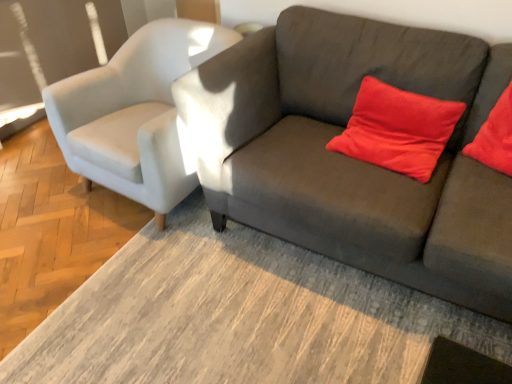
The image size is (512, 384). I want to click on satin white armchair at left, so [x=135, y=114].

You are a GUI agent. You are given a task and a screenshot of the screen. Output one action in this format:
    pyautogui.click(x=<x>, y=<y>)
    Task: Click on the dark gray fabric couch at center
    
    Given the screenshot: What is the action you would take?
    pyautogui.click(x=352, y=158)

Is satin red pillow at upper right not near dark gray fabric couch at center?

No.

From the image's perspective, is satin red pillow at upper right beneath dark gray fabric couch at center?

Incorrect, from the image's perspective, satin red pillow at upper right is higher than dark gray fabric couch at center.

The height and width of the screenshot is (384, 512). I want to click on studio couch below the satin red pillow at upper right (from the image's perspective), so click(x=352, y=158).

Does satin red pillow at upper right have a lesser width compared to dark gray fabric couch at center?

Yes, satin red pillow at upper right is thinner than dark gray fabric couch at center.

Considering the sizes of objects satin white armchair at left and dark gray fabric couch at center in the image provided, who is wider, satin white armchair at left or dark gray fabric couch at center?

With larger width is dark gray fabric couch at center.

Can you confirm if satin white armchair at left is positioned to the right of dark gray fabric couch at center?

No, satin white armchair at left is not to the right of dark gray fabric couch at center.

Looking at the image, does satin white armchair at left seem bigger or smaller compared to dark gray fabric couch at center?

Clearly, satin white armchair at left is smaller in size than dark gray fabric couch at center.

From the image's perspective, is satin white armchair at left on top of dark gray fabric couch at center?

Yes, from the image's perspective, satin white armchair at left is on top of dark gray fabric couch at center.

From a real-world perspective, is satin red pillow at upper right positioned over satin white armchair at left based on gravity?

Yes.

Is satin red pillow at upper right aimed at satin white armchair at left?

No.

Looking at this image, from the image's perspective, is satin red pillow at upper right on satin white armchair at left?

No.

From the image's perspective, is dark gray fabric couch at center above satin white armchair at left?

No, from the image's perspective, dark gray fabric couch at center is not above satin white armchair at left.

From their relative heights in the image, would you say dark gray fabric couch at center is taller or shorter than satin white armchair at left?

dark gray fabric couch at center is taller than satin white armchair at left.

Is point (499, 75) farther from camera compared to point (117, 75)?

No, (499, 75) is closer to viewer.

Does dark gray fabric couch at center contain satin white armchair at left?

No.

How many degrees apart are the facing directions of dark gray fabric couch at center and satin red pillow at upper right?

The facing directions of dark gray fabric couch at center and satin red pillow at upper right are 5.33 degrees apart.

In terms of width, does dark gray fabric couch at center look wider or thinner when compared to satin red pillow at upper right?

In the image, dark gray fabric couch at center appears to be wider than satin red pillow at upper right.

Identify the location of pillow behind the dark gray fabric couch at center. This screenshot has height=384, width=512. (398, 129).

Could you tell me if dark gray fabric couch at center is facing satin red pillow at upper right?

Yes, dark gray fabric couch at center is turned towards satin red pillow at upper right.

Is satin white armchair at left positioned far away from satin red pillow at upper right?

No, satin white armchair at left is not far from satin red pillow at upper right.

Locate an element on the screen. pillow below the satin white armchair at left (from the image's perspective) is located at coordinates (398, 129).

Does satin white armchair at left turn towards satin red pillow at upper right?

No.

Is satin white armchair at left not inside satin red pillow at upper right?

Yes.

Identify the location of studio couch below the satin red pillow at upper right (from the image's perspective). (x=352, y=158).

The image size is (512, 384). In the image, there is a dark gray fabric couch at center. Identify the location of chair above it (from the image's perspective). (135, 114).

When comparing their distances from satin white armchair at left, does dark gray fabric couch at center or satin red pillow at upper right seem further?

Among the two, satin red pillow at upper right is located further to satin white armchair at left.

Looking at the image, which one is located closer to satin red pillow at upper right, satin white armchair at left or dark gray fabric couch at center?

The object closer to satin red pillow at upper right is dark gray fabric couch at center.

Looking at the image, which one is located further to satin white armchair at left, satin red pillow at upper right or dark gray fabric couch at center?

satin red pillow at upper right is further to satin white armchair at left.

Estimate the real-world distances between objects in this image. Which object is closer to satin red pillow at upper right, dark gray fabric couch at center or satin white armchair at left?

Based on the image, dark gray fabric couch at center appears to be nearer to satin red pillow at upper right.

From the image, which object appears to be nearer to dark gray fabric couch at center, satin red pillow at upper right or satin white armchair at left?

Among the two, satin red pillow at upper right is located nearer to dark gray fabric couch at center.

Based on their spatial positions, is satin white armchair at left or satin red pillow at upper right further from dark gray fabric couch at center?

satin white armchair at left lies further to dark gray fabric couch at center than the other object.

Identify the location of studio couch between satin white armchair at left and satin red pillow at upper right in the horizontal direction. This screenshot has height=384, width=512. (352, 158).